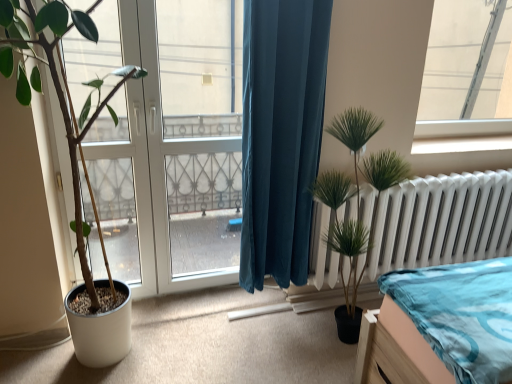
Question: Is transparent glass window at upper right placed right next to green artificial plant at right, which appears as the second houseplant when viewed from the left?

Choices:
 (A) yes
 (B) no

Answer: (B)

Question: Is transparent glass window at upper right facing away from green artificial plant at right, which appears as the second houseplant when viewed from the left?

Choices:
 (A) yes
 (B) no

Answer: (B)

Question: Can we say transparent glass window at upper right lies outside green artificial plant at right, the first houseplant positioned from the right?

Choices:
 (A) yes
 (B) no

Answer: (A)

Question: Is transparent glass window at upper right thinner than green artificial plant at right, which appears as the second houseplant when viewed from the left?

Choices:
 (A) no
 (B) yes

Answer: (B)

Question: Considering the relative sizes of transparent glass window at upper right and green artificial plant at right, which appears as the second houseplant when viewed from the left, in the image provided, is transparent glass window at upper right bigger than green artificial plant at right, which appears as the second houseplant when viewed from the left,?

Choices:
 (A) yes
 (B) no

Answer: (B)

Question: Based on their sizes in the image, would you say green matte plant at left, positioned as the 2th houseplant in right-to-left order, is bigger or smaller than white metallic radiator at right?

Choices:
 (A) small
 (B) big

Answer: (B)

Question: From the image's perspective, is green matte plant at left, positioned as the 2th houseplant in right-to-left order, positioned above or below white metallic radiator at right?

Choices:
 (A) below
 (B) above

Answer: (B)

Question: From a real-world perspective, is green matte plant at left, positioned as the 2th houseplant in right-to-left order, above or below white metallic radiator at right?

Choices:
 (A) below
 (B) above

Answer: (B)

Question: In terms of height, does green matte plant at left, positioned as the 2th houseplant in right-to-left order, look taller or shorter compared to white metallic radiator at right?

Choices:
 (A) tall
 (B) short

Answer: (A)

Question: From a real-world perspective, is teal velvet curtain at center physically located above or below green artificial plant at right, which appears as the second houseplant when viewed from the left?

Choices:
 (A) below
 (B) above

Answer: (B)

Question: Looking at their shapes, would you say teal velvet curtain at center is wider or thinner than green artificial plant at right, the first houseplant positioned from the right?

Choices:
 (A) wide
 (B) thin

Answer: (B)

Question: From the image's perspective, is teal velvet curtain at center located above or below green artificial plant at right, the first houseplant positioned from the right?

Choices:
 (A) above
 (B) below

Answer: (A)

Question: Relative to green artificial plant at right, the first houseplant positioned from the right, is teal velvet curtain at center in front or behind?

Choices:
 (A) front
 (B) behind

Answer: (B)

Question: From the image's perspective, is green artificial plant at right, which appears as the second houseplant when viewed from the left, positioned above or below transparent glass door at center?

Choices:
 (A) below
 (B) above

Answer: (A)

Question: Is point (353, 243) positioned closer to the camera than point (215, 130)?

Choices:
 (A) closer
 (B) farther

Answer: (A)